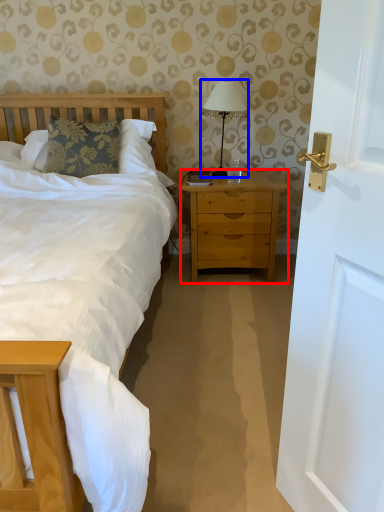
Question: Which point is closer to the camera, nightstand (highlighted by a red box) or bedside lamp (highlighted by a blue box)?

Choices:
 (A) nightstand
 (B) bedside lamp

Answer: (B)